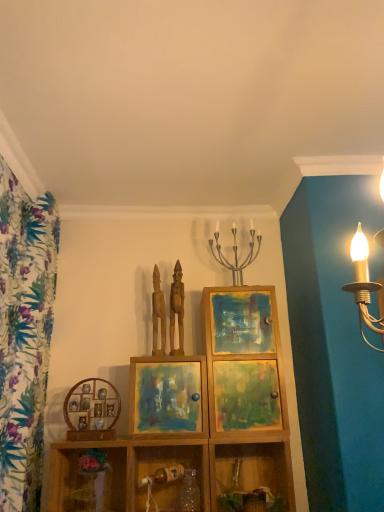
Where is `blank area beneath wooden picture frame at center-left, positioned as the first picture frame in left-to-right order (from a real-world perspective)`? This screenshot has height=512, width=384. blank area beneath wooden picture frame at center-left, positioned as the first picture frame in left-to-right order (from a real-world perspective) is located at coordinates (85, 441).